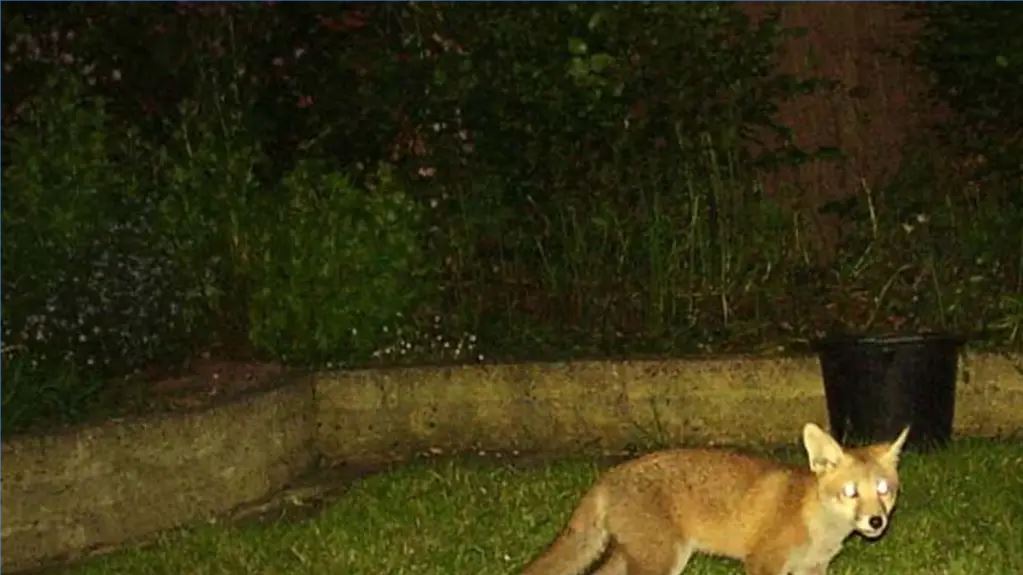
You are a GUI agent. You are given a task and a screenshot of the screen. Output one action in this format:
    pyautogui.click(x=<x>, y=<y>)
    Task: Click on the wall
    
    Given the screenshot: What is the action you would take?
    pyautogui.click(x=864, y=72)